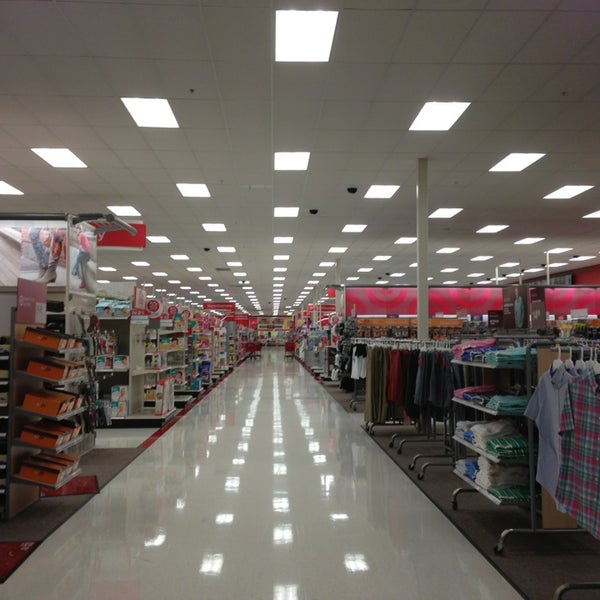
Find the location of `shelves in store holding products`. shelves in store holding products is located at coordinates (137, 342).